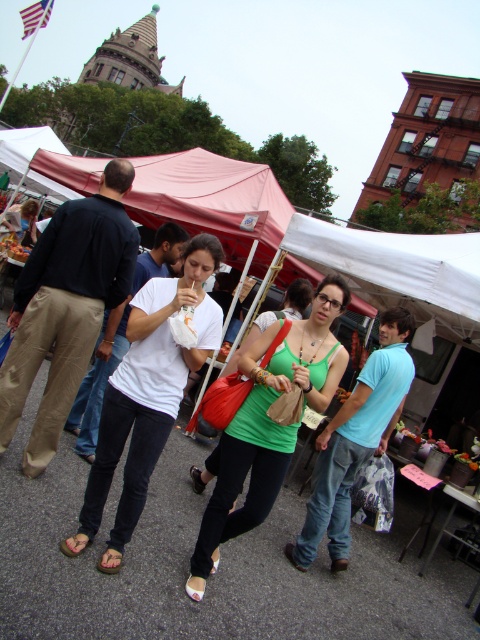
Between dark blue shirt at center and light blue cotton shirt at center, which one has more height?

With more height is dark blue shirt at center.

The height and width of the screenshot is (640, 480). Describe the element at coordinates (66, 307) in the screenshot. I see `dark blue shirt at center` at that location.

Between point (64, 328) and point (312, 493), which one is positioned in front?

Point (64, 328) is more forward.

Locate an element on the screen. dark blue shirt at center is located at coordinates (66, 307).

Can you confirm if green fabric sandal at lower left is wider than brown leather sandal at lower left?

No.

Is green fabric sandal at lower left further to camera compared to brown leather sandal at lower left?

No, it is not.

At what (x,y) coordinates should I click in order to perform the action: click on green fabric sandal at lower left. Please return your answer as a coordinate pair (x, y). The width and height of the screenshot is (480, 640). Looking at the image, I should click on (108, 566).

Who is taller, light blue cotton shirt at center or brown leather sandal at lower left?

With more height is light blue cotton shirt at center.

The image size is (480, 640). Describe the element at coordinates (355, 442) in the screenshot. I see `light blue cotton shirt at center` at that location.

Between point (319, 496) and point (64, 552), which one is positioned in front?

Positioned in front is point (64, 552).

This screenshot has width=480, height=640. I want to click on light blue cotton shirt at center, so click(355, 442).